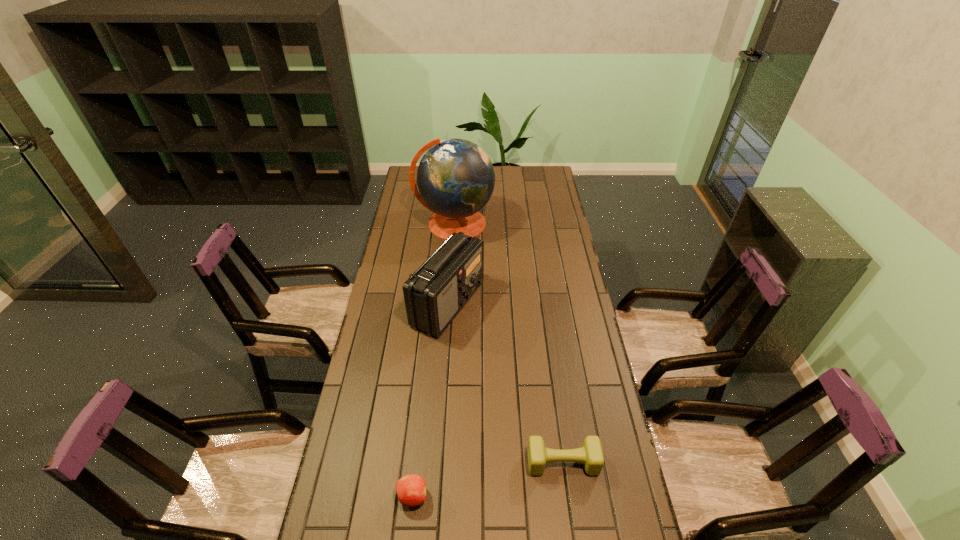
At what (x,y) coordinates should I click in order to perform the action: click on vacant position in the image that satisfies the following two spatial constraints: 1. with the Americas facing the viewer on the third farthest object; 2. on the left side of the farthest object. Please return your answer as a coordinate pair (x, y). Looking at the image, I should click on (437, 462).

This screenshot has height=540, width=960. Identify the location of free location that satisfies the following two spatial constraints: 1. on the front panel of the radio receiver; 2. on the left side of the third farthest object. (437, 462).

This screenshot has width=960, height=540. I want to click on vacant region that satisfies the following two spatial constraints: 1. with the Americas facing the viewer on the rightmost object; 2. on the left side of the tallest object, so click(x=437, y=462).